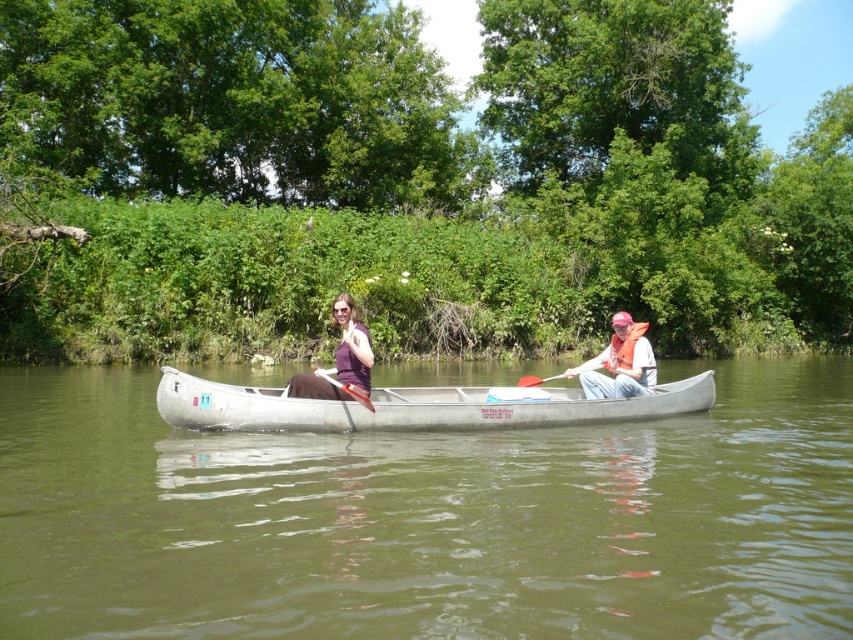
Between matte purple shirt at center and purple fabric at center, which one is positioned higher?

Positioned higher is purple fabric at center.

Does point (637, 365) lie behind point (335, 396)?

Yes.

Which is behind, point (361, 336) or point (367, 355)?

Point (361, 336)

Locate an element on the screen. This screenshot has width=853, height=640. matte purple shirt at center is located at coordinates (622, 362).

Is metallic gray canoe at center to the left of matte purple shirt at center from the viewer's perspective?

Correct, you'll find metallic gray canoe at center to the left of matte purple shirt at center.

This screenshot has width=853, height=640. What do you see at coordinates (413, 406) in the screenshot? I see `metallic gray canoe at center` at bounding box center [413, 406].

Find the location of a particular element. The height and width of the screenshot is (640, 853). metallic gray canoe at center is located at coordinates (413, 406).

Is greenish-brown water at center behind matte orange life vest at right?

No, greenish-brown water at center is in front of matte orange life vest at right.

Is point (20, 593) more distant than point (636, 333)?

No, it is in front of (636, 333).

Identify the location of greenish-brown water at center. This screenshot has height=640, width=853. [428, 518].